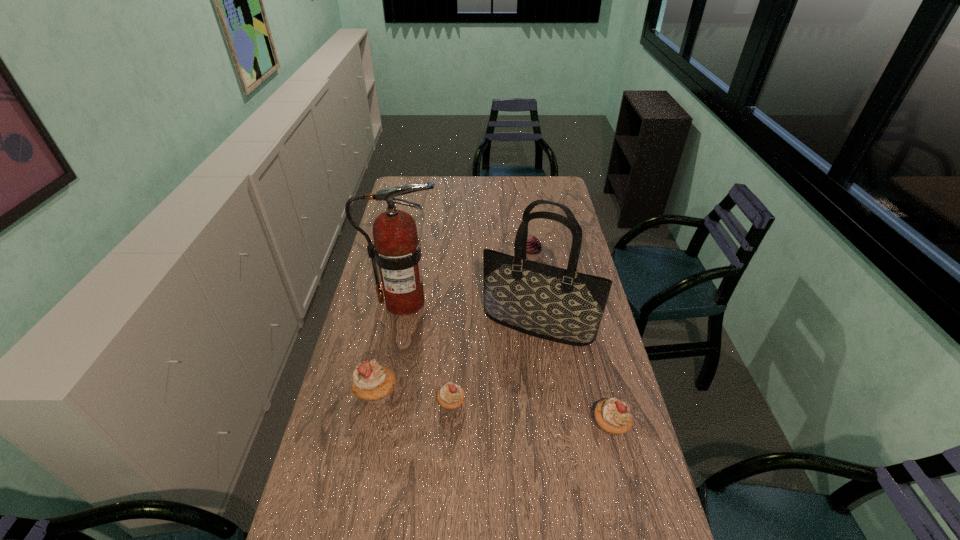
Find the location of a particular element. The width and height of the screenshot is (960, 540). vacant space located 0.250m on the left of the rightmost cupcake is located at coordinates (507, 425).

I want to click on vacant space located on the front of the farthest object, so click(x=536, y=291).

The image size is (960, 540). In order to click on free space located on the front of the tote bag in this screenshot , I will do `click(545, 378)`.

I want to click on vacant space located 0.070m at the nozzle of the fire extinguisher, so click(462, 302).

I want to click on cupcake present at the left edge, so click(372, 382).

Locate an element on the screen. Image resolution: width=960 pixels, height=540 pixels. fire extinguisher present at the left edge is located at coordinates (397, 250).

At what (x,y) coordinates should I click in order to perform the action: click on cupcake situated at the right edge. Please return your answer as a coordinate pair (x, y). The width and height of the screenshot is (960, 540). Looking at the image, I should click on (613, 416).

This screenshot has height=540, width=960. Find the location of `tote bag that is positioned at the right edge`. tote bag that is positioned at the right edge is located at coordinates (561, 305).

Where is `vacant space at the far edge`? This screenshot has width=960, height=540. vacant space at the far edge is located at coordinates (509, 194).

This screenshot has width=960, height=540. Identify the location of blank space at the near edge of the desktop. (531, 534).